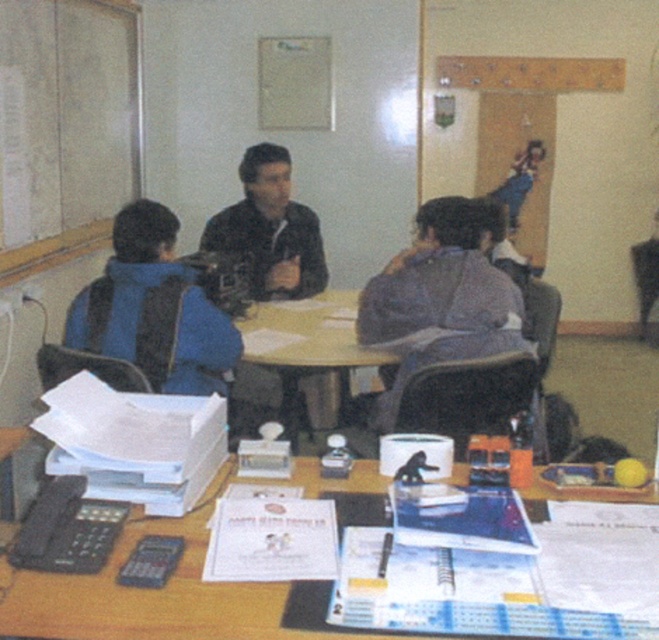
Question: Does blue fabric jacket at left have a smaller size compared to wooden table at center?

Choices:
 (A) yes
 (B) no

Answer: (A)

Question: Estimate the real-world distances between objects in this image. Which object is closer to the wooden table at center?

Choices:
 (A) white matte bulletin board at upper left
 (B) gray fabric jacket at center

Answer: (B)

Question: Which point is farther from the camera taking this photo?

Choices:
 (A) (297, 225)
 (B) (413, 252)

Answer: (A)

Question: Which point appears closest to the camera in this image?

Choices:
 (A) (40, 598)
 (B) (142, 296)

Answer: (A)

Question: Is white matte bulletin board at upper left to the left of wooden desk at lower center from the viewer's perspective?

Choices:
 (A) no
 (B) yes

Answer: (B)

Question: Does wooden desk at lower center appear on the left side of blue fabric jacket at left?

Choices:
 (A) no
 (B) yes

Answer: (A)